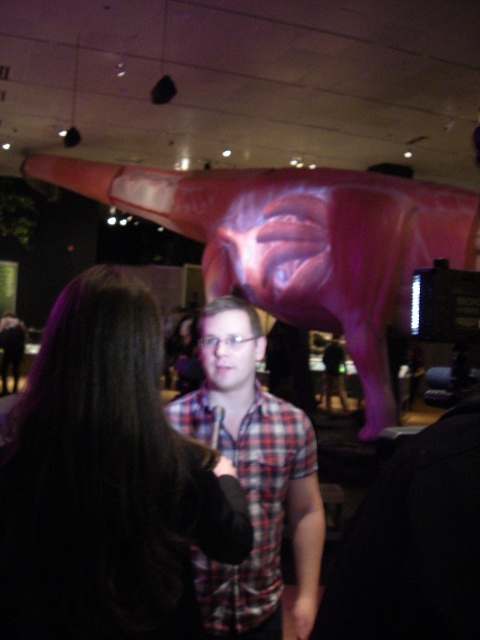
You are a photographer positioned at the entrance of the museum. You want to capture a photo of the dark brown hair at center and the plaid shirt at center without any overlap between them. Given their sizes, is it possible to adjust your camera angle to ensure both are fully visible without overlapping?

The dark brown hair at center has a smaller size compared to plaid shirt at center. Since the dark brown hair is smaller, adjusting the camera angle could allow both to be framed without overlapping, as the plaid shirt at center occupies more space and can be positioned appropriately in the frame.

You are an interior designer planning to place a new sofa in this room. The sofa must be positioned so that it faces the glossy pink statue at upper center but also allows a clear view of the plaid shirt at center. Given the spatial relationship between these two objects, is this arrangement feasible?

The glossy pink statue at upper center is much taller than the plaid shirt at center. Since the statue is taller, it might block the view of the plaid shirt at center when facing it. Therefore, positioning the sofa to face the statue while maintaining a clear view of the plaid shirt at center may not be feasible unless the sofa is placed at an angle or positioned where both can be seen around the statue.

You are standing at the entrance of the museum and want to take a photo of the dark brown hair at center. Where should you position yourself to capture it in the frame?

To capture the dark brown hair at center in the frame, position yourself such that the camera is aimed at the coordinates 0.753 on the x axis and 0.223 on the y axis, as that is the 2D location of the dark brown hair at center.